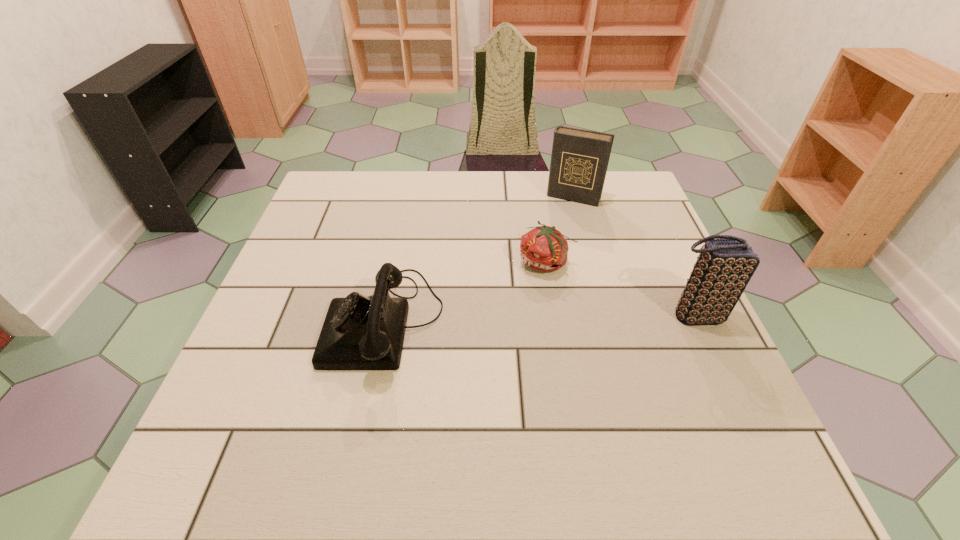
This screenshot has height=540, width=960. Find the location of `vacant space that satisfies the following two spatial constraints: 1. on the front side of the tomato; 2. with the zip open on the rightmost object`. vacant space that satisfies the following two spatial constraints: 1. on the front side of the tomato; 2. with the zip open on the rightmost object is located at coordinates (555, 315).